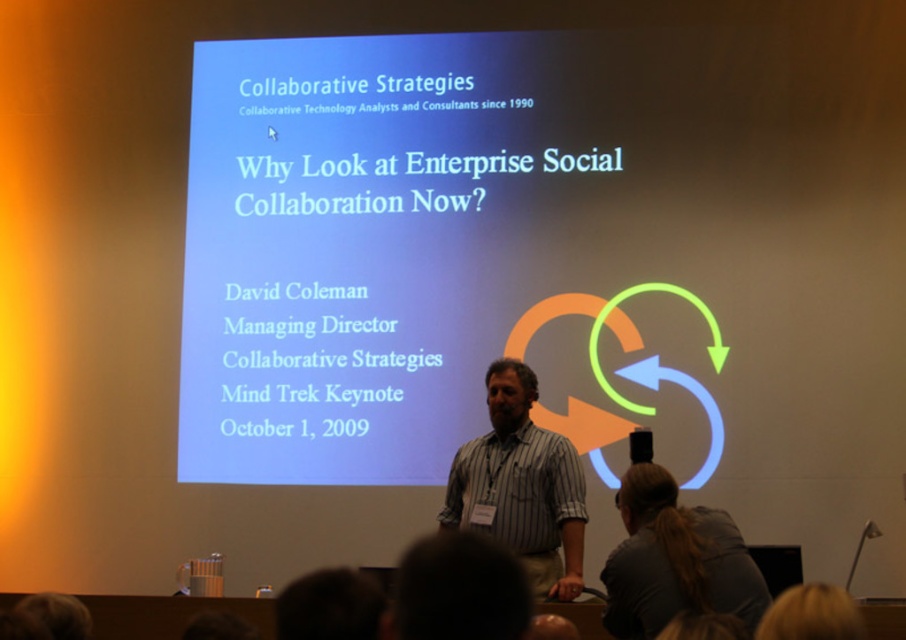
You are attending a virtual conference and want to ask a question to the speaker. You see the gray fabric ponytail at lower center and dark hair at lower center. Which one is closer to you?

The gray fabric ponytail at lower center is closer to you because it is further to the viewer than dark hair at lower center.

You are an event photographer at the Mind Trek Keynote. You need to capture a clear photo of the speaker David Coleman. However, there is a gray fabric ponytail at lower center and a dark hair at lower center in the frame. Which object is blocking the view of the speaker?

The gray fabric ponytail at lower center is positioned under dark hair at lower center, so the dark hair at lower center is blocking the view of the speaker.